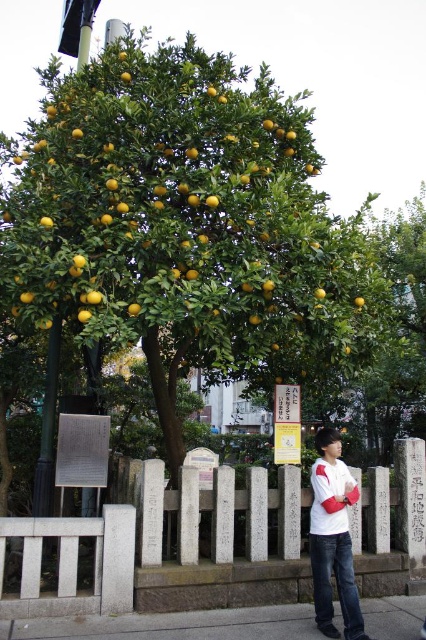
Question: Which object is the farthest from the white stone fence at center?

Choices:
 (A) white matte shirt at center
 (B) yellow matte/orange at center

Answer: (B)

Question: Does white stone fence at center have a lesser width compared to yellow matte/orange at center?

Choices:
 (A) yes
 (B) no

Answer: (B)

Question: Does gray concrete pavement at lower center appear under yellow matte/orange at center?

Choices:
 (A) no
 (B) yes

Answer: (B)

Question: Which point is farther to the camera?

Choices:
 (A) white matte shirt at center
 (B) gray concrete pavement at lower center

Answer: (A)

Question: Is white matte shirt at center wider than yellow matte/orange at center?

Choices:
 (A) yes
 (B) no

Answer: (A)

Question: Which object is closer to the camera taking this photo?

Choices:
 (A) white matte shirt at center
 (B) gray concrete pavement at lower center

Answer: (B)